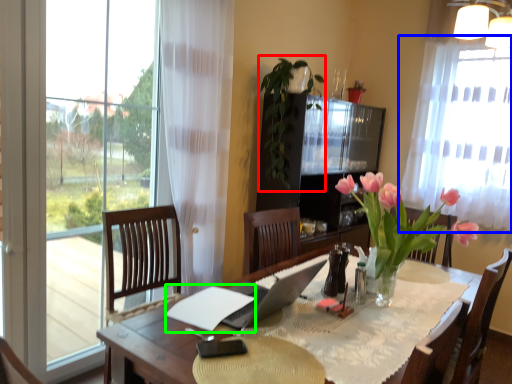
Question: Estimate the real-world distances between objects in this image. Which object is closer to plant (highlighted by a red box), curtain (highlighted by a blue box) or notepad (highlighted by a green box)?

Choices:
 (A) curtain
 (B) notepad

Answer: (A)